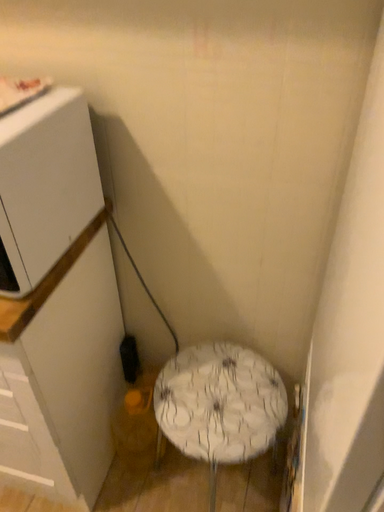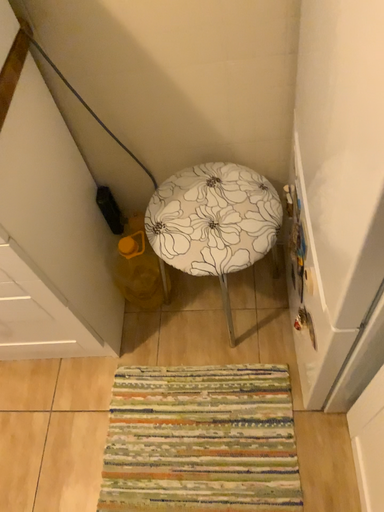
Question: Which way did the camera rotate in the video?

Choices:
 (A) rotated upward
 (B) rotated downward

Answer: (B)